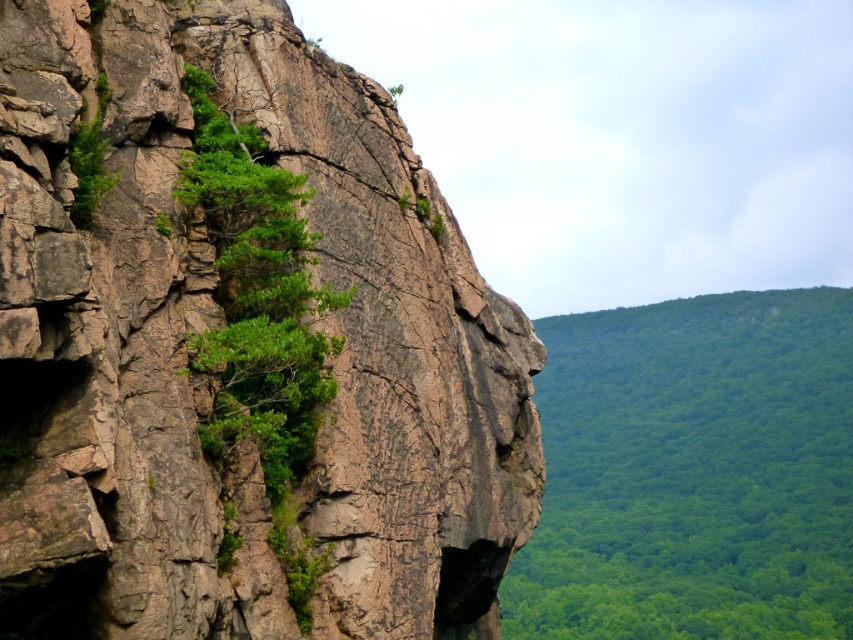
You are standing at the base of the cliff on the left side of the image. You see a point marked at coordinates (693, 472). Based on the scene description, can you determine which object this point is located on?

The point at coordinates (693, 472) is located on the green leafy tree at right.

You are standing at the base of the cliff and want to reach the green leafy tree at right. Which direction should you move relative to the rusty brown rock at center?

You should move away from the rusty brown rock at center because the green leafy tree at right is further away from the viewer than the rusty brown rock at center.